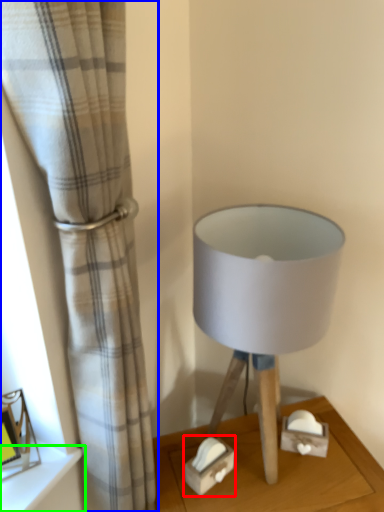
Question: Based on their relative distances, which object is farther from box (highlighted by a red box)? Choose from curtain (highlighted by a blue box) and shelf (highlighted by a green box).

Choices:
 (A) curtain
 (B) shelf

Answer: (A)